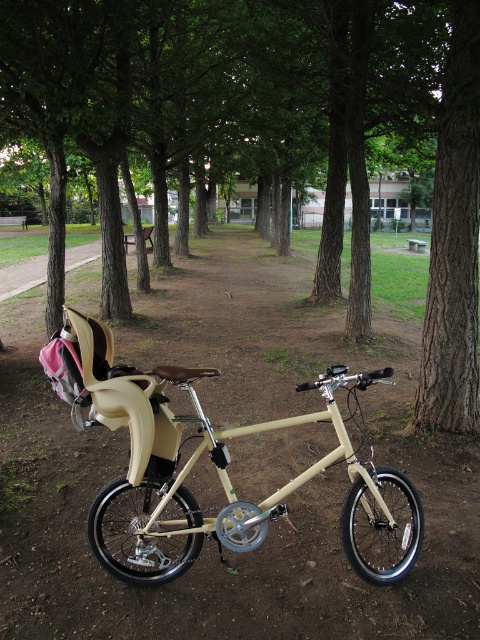
Who is positioned more to the right, brown wood tree at center or beige matte baby carriage at center?

From the viewer's perspective, beige matte baby carriage at center appears more on the right side.

Where is `brown wood tree at center`? brown wood tree at center is located at coordinates click(279, 99).

You are a GUI agent. You are given a task and a screenshot of the screen. Output one action in this format:
    pyautogui.click(x=<x>, y=<y>)
    Task: Click on the brown wood tree at center
    Image resolution: width=480 pixels, height=640 pixels.
    Given the screenshot: What is the action you would take?
    pyautogui.click(x=279, y=99)

Consider the image. Can you confirm if brown wood tree at center is positioned above beige matte bicycle at center?

Correct, brown wood tree at center is located above beige matte bicycle at center.

Does brown wood tree at center have a greater width compared to beige matte bicycle at center?

Indeed, brown wood tree at center has a greater width compared to beige matte bicycle at center.

Where is `brown wood tree at center`? The image size is (480, 640). brown wood tree at center is located at coordinates (279, 99).

Where is `brown wood tree at center`? The image size is (480, 640). brown wood tree at center is located at coordinates (279, 99).

Does beige matte bicycle at center appear on the left side of beige matte baby carriage at center?

Incorrect, beige matte bicycle at center is not on the left side of beige matte baby carriage at center.

Can you confirm if beige matte bicycle at center is smaller than beige matte baby carriage at center?

Actually, beige matte bicycle at center might be larger than beige matte baby carriage at center.

Locate an element on the screen. The image size is (480, 640). beige matte bicycle at center is located at coordinates (245, 500).